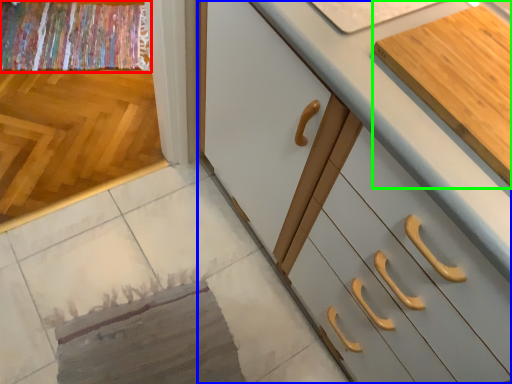
Question: Estimate the real-world distances between objects in this image. Which object is closer to blanket (highlighted by a red box), cabinetry (highlighted by a blue box) or cabinetry (highlighted by a green box)?

Choices:
 (A) cabinetry
 (B) cabinetry

Answer: (A)